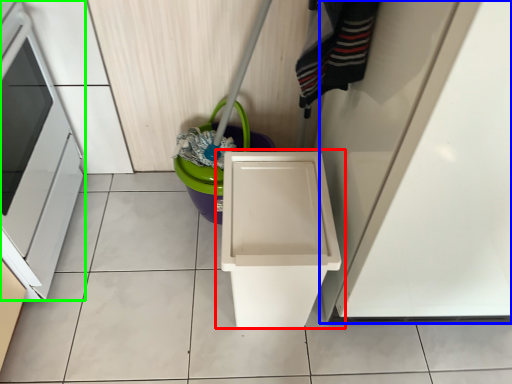
Question: Which is nearer to the waste container (highlighted by a red box)? door (highlighted by a blue box) or oven (highlighted by a green box).

Choices:
 (A) door
 (B) oven

Answer: (A)